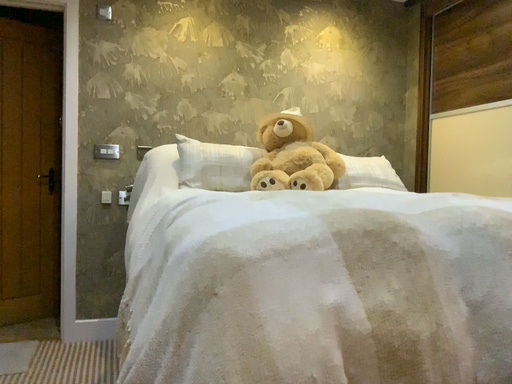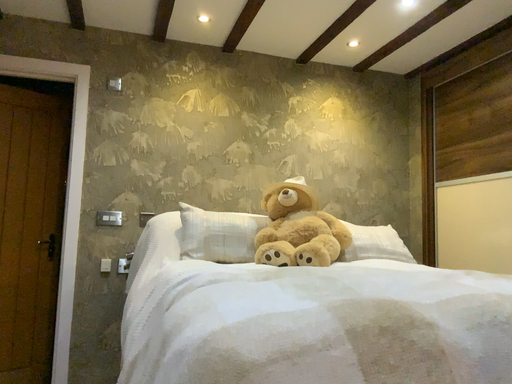
Question: How did the camera likely rotate when shooting the video?

Choices:
 (A) rotated upward
 (B) rotated downward

Answer: (A)